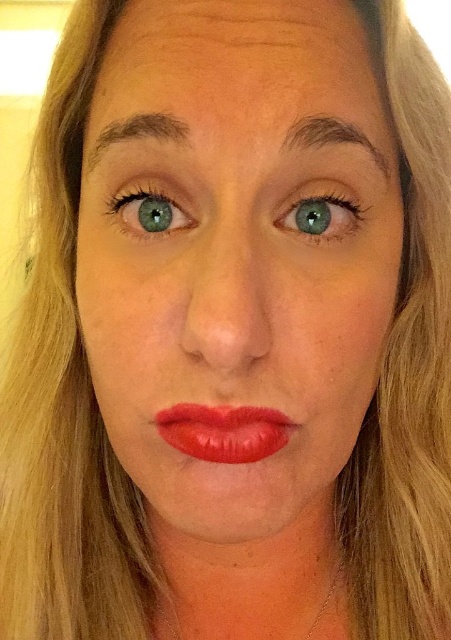
Who is taller, green matte eye at upper center or dark brown hair at upper center?

green matte eye at upper center

Can you confirm if green matte eye at upper center is shorter than dark brown hair at upper center?

In fact, green matte eye at upper center may be taller than dark brown hair at upper center.

Where is `green matte eye at upper center`? green matte eye at upper center is located at coordinates (148, 209).

This screenshot has width=451, height=640. In order to click on green matte eye at upper center in this screenshot , I will do `click(148, 209)`.

Between point (210, 422) and point (128, 182), which one is positioned in front?

Positioned in front is point (210, 422).

Measure the distance between shiny red lipstick at center and camera.

shiny red lipstick at center is 10.69 inches away from camera.

This screenshot has width=451, height=640. Identify the location of shiny red lipstick at center. (224, 432).

Is point (364, 211) closer to viewer compared to point (116, 204)?

Yes, it is.

Is green matte eye at center positioned in front of green matte eye at upper center?

That is True.

Describe the element at coordinates (320, 211) in the screenshot. I see `green matte eye at center` at that location.

Image resolution: width=451 pixels, height=640 pixels. I want to click on green matte eye at center, so click(x=320, y=211).